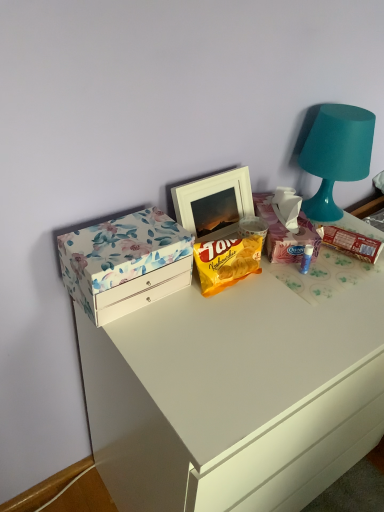
In order to click on free space in front of floral cardboard box at upper right in this screenshot , I will do `click(311, 284)`.